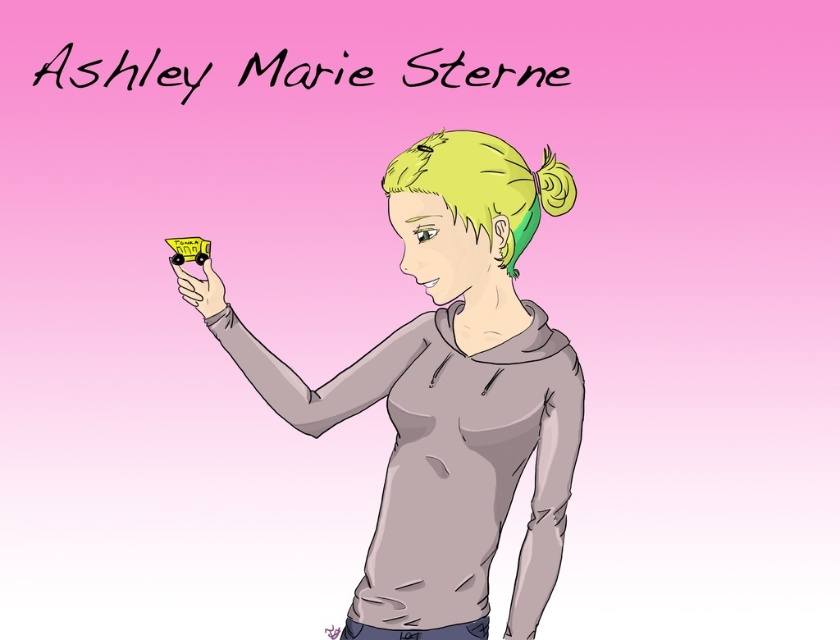
Between point (546, 353) and point (205, 269), which one is positioned behind?

The point (205, 269) is behind.

Does matte yellow toy truck at upper left have a smaller size compared to matte yellow toy car at center?

Actually, matte yellow toy truck at upper left might be larger than matte yellow toy car at center.

Who is more forward, (546, 436) or (187, 282)?

Point (187, 282) is more forward.

Identify the location of matte yellow toy truck at upper left. Image resolution: width=840 pixels, height=640 pixels. (452, 396).